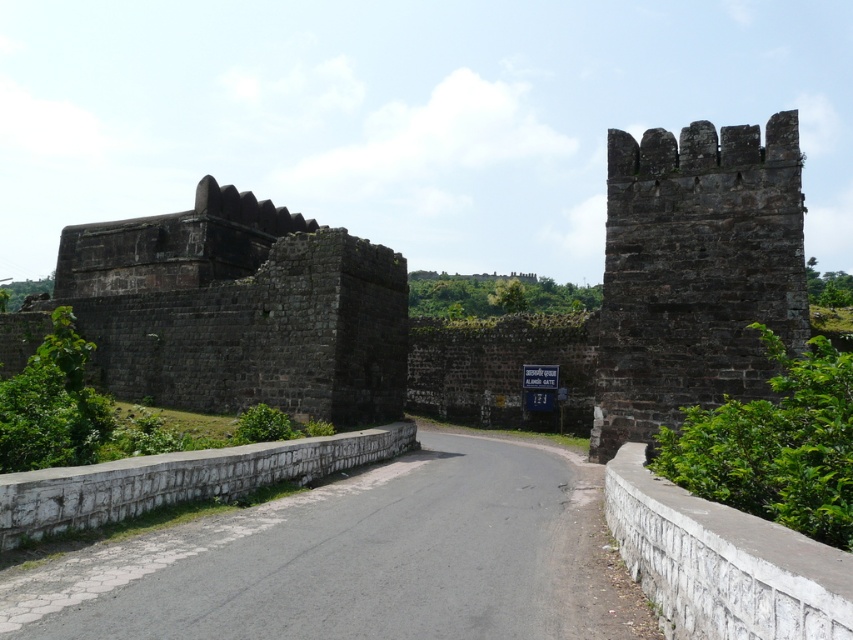
Question: Which point is farther to the camera?

Choices:
 (A) (265, 230)
 (B) (112, 467)
 (C) (680, 177)

Answer: (A)

Question: Which object appears closest to the camera in this image?

Choices:
 (A) white stone wall at lower center
 (B) dark stone wall at center

Answer: (A)

Question: Among these objects, which one is farthest from the camera?

Choices:
 (A) white stone wall at right
 (B) dark brown stone tower at right
 (C) dark stone wall at center
 (D) white stone wall at lower center

Answer: (C)

Question: Can you confirm if dark brown stone tower at right is wider than white stone wall at lower center?

Choices:
 (A) yes
 (B) no

Answer: (B)

Question: Does dark stone wall at center appear on the left side of dark brown stone tower at right?

Choices:
 (A) no
 (B) yes

Answer: (B)

Question: Can you confirm if dark brown stone tower at right is wider than white stone wall at right?

Choices:
 (A) yes
 (B) no

Answer: (A)